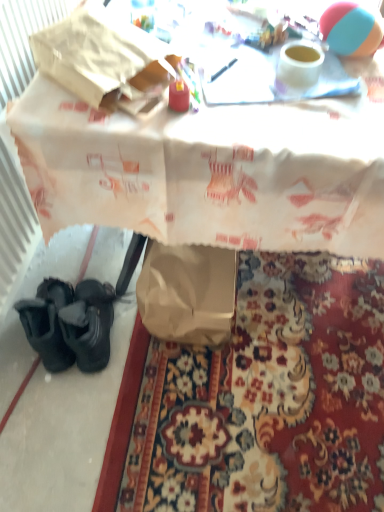
Locate an element on the screen. The image size is (384, 512). vacant area that is in front of rubber beach ball at upper right is located at coordinates (347, 91).